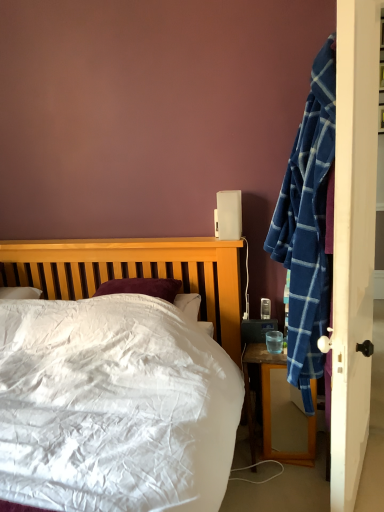
Question: Considering the relative sizes of wooden desk at right and clear glass cup at nightstand right in the image provided, is wooden desk at right shorter than clear glass cup at nightstand right?

Choices:
 (A) no
 (B) yes

Answer: (A)

Question: Is wooden desk at right smaller than clear glass cup at nightstand right?

Choices:
 (A) yes
 (B) no

Answer: (B)

Question: From the image's perspective, would you say wooden desk at right is shown under clear glass cup at nightstand right?

Choices:
 (A) yes
 (B) no

Answer: (A)

Question: Is wooden desk at right wider than clear glass cup at nightstand right?

Choices:
 (A) yes
 (B) no

Answer: (A)

Question: Considering the relative sizes of wooden desk at right and clear glass cup at nightstand right in the image provided, is wooden desk at right taller than clear glass cup at nightstand right?

Choices:
 (A) no
 (B) yes

Answer: (B)

Question: From the image's perspective, relative to wooden desk at right, is white plastic speaker at upper right above or below?

Choices:
 (A) below
 (B) above

Answer: (B)

Question: Would you say white plastic speaker at upper right is to the left or to the right of wooden desk at right in the picture?

Choices:
 (A) right
 (B) left

Answer: (B)

Question: In terms of height, does white plastic speaker at upper right look taller or shorter compared to wooden desk at right?

Choices:
 (A) short
 (B) tall

Answer: (A)

Question: Is point (226, 227) closer or farther from the camera than point (243, 364)?

Choices:
 (A) closer
 (B) farther

Answer: (A)

Question: Considering their positions, is wooden desk at right located in front of or behind white plastic speaker at upper right?

Choices:
 (A) behind
 (B) front

Answer: (B)

Question: Would you say wooden desk at right is inside or outside white plastic speaker at upper right?

Choices:
 (A) inside
 (B) outside

Answer: (B)

Question: Considering the relative positions of wooden desk at right and white plastic speaker at upper right in the image provided, is wooden desk at right to the left or to the right of white plastic speaker at upper right?

Choices:
 (A) left
 (B) right

Answer: (B)

Question: Considering the positions of wooden desk at right and white plastic speaker at upper right in the image, is wooden desk at right bigger or smaller than white plastic speaker at upper right?

Choices:
 (A) small
 (B) big

Answer: (B)

Question: Would you say clear glass cup at nightstand right is to the left or to the right of white plastic speaker at upper right in the picture?

Choices:
 (A) right
 (B) left

Answer: (A)

Question: Does point (273, 338) appear closer or farther from the camera than point (228, 202)?

Choices:
 (A) farther
 (B) closer

Answer: (A)